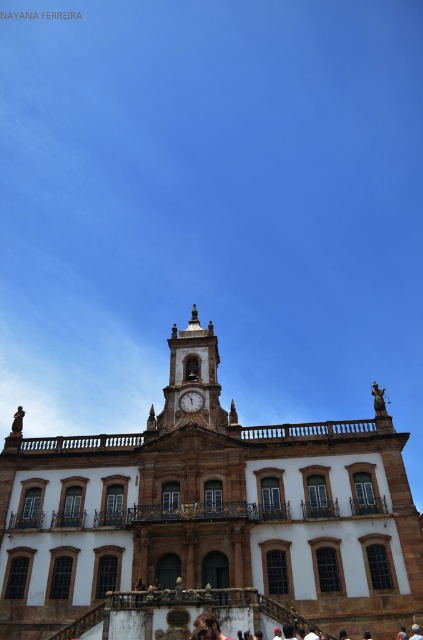
Question: Which of these objects is positioned closest to the gold ornate clock tower at center?

Choices:
 (A) matte brown clock at center
 (B) brown stone church at center

Answer: (A)

Question: Which point is closer to the camera taking this photo?

Choices:
 (A) (162, 620)
 (B) (164, 387)
 (C) (203, 401)

Answer: (A)

Question: Is gold ornate clock tower at center bigger than matte brown clock at center?

Choices:
 (A) no
 (B) yes

Answer: (B)

Question: Considering the real-world distances, which object is farthest from the brown stone church at center?

Choices:
 (A) matte brown clock at center
 (B) gold ornate clock tower at center

Answer: (A)

Question: Can you confirm if brown stone church at center is positioned above gold ornate clock tower at center?

Choices:
 (A) yes
 (B) no

Answer: (B)

Question: Does gold ornate clock tower at center come behind matte brown clock at center?

Choices:
 (A) yes
 (B) no

Answer: (B)